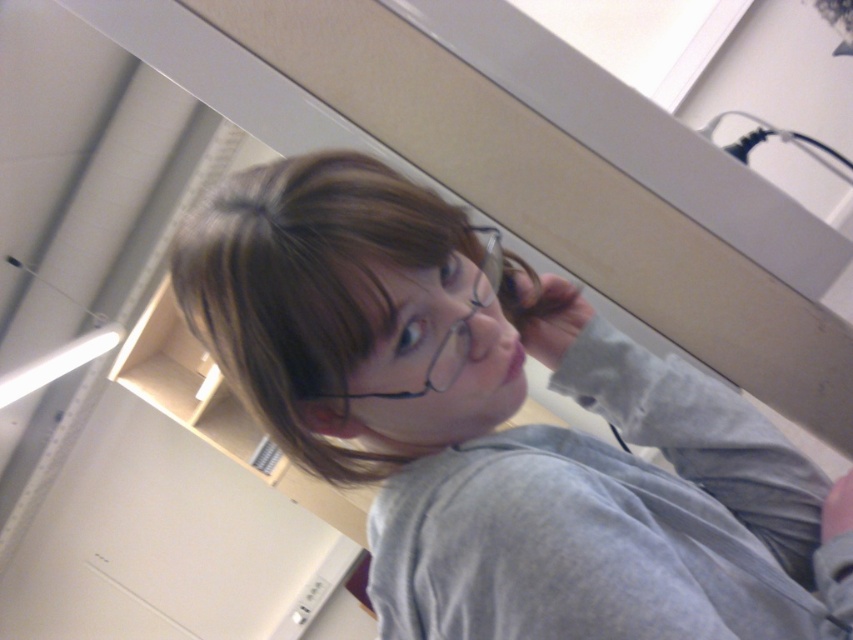
Question: Can you confirm if brown matte hair at upper center is bigger than clear plastic glasses at center?

Choices:
 (A) no
 (B) yes

Answer: (B)

Question: Does gray matte shirt at center appear under clear plastic glasses at center?

Choices:
 (A) no
 (B) yes

Answer: (B)

Question: Which is nearer to the gray matte shirt at center?

Choices:
 (A) clear plastic glasses at center
 (B) brown matte hair at upper center

Answer: (B)

Question: Estimate the real-world distances between objects in this image. Which object is closer to the clear plastic glasses at center?

Choices:
 (A) gray matte shirt at center
 (B) brown matte hair at upper center

Answer: (B)

Question: In this image, where is brown matte hair at upper center located relative to clear plastic glasses at center?

Choices:
 (A) below
 (B) above

Answer: (B)

Question: Which point appears farthest from the camera in this image?

Choices:
 (A) coord(393,216)
 (B) coord(364,396)

Answer: (B)